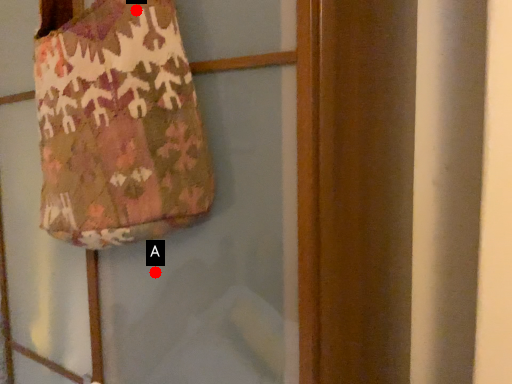
Question: Two points are circled on the image, labeled by A and B beside each circle. Which point is closer to the camera?

Choices:
 (A) A is closer
 (B) B is closer

Answer: (B)